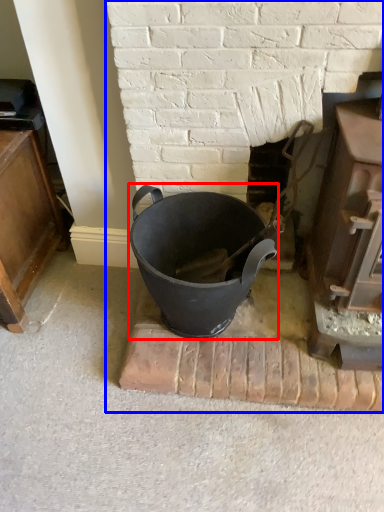
Question: Which object appears farthest to the camera in this image, crock pot (highlighted by a red box) or fireplace (highlighted by a blue box)?

Choices:
 (A) crock pot
 (B) fireplace

Answer: (A)